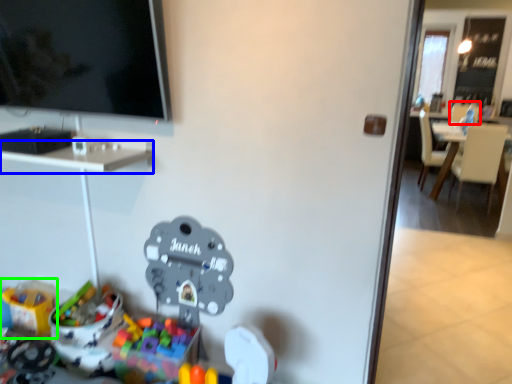
Question: Estimate the real-world distances between objects in this image. Which object is closer to armchair (highlighted by a red box), desk (highlighted by a blue box) or toy (highlighted by a green box)?

Choices:
 (A) desk
 (B) toy

Answer: (A)